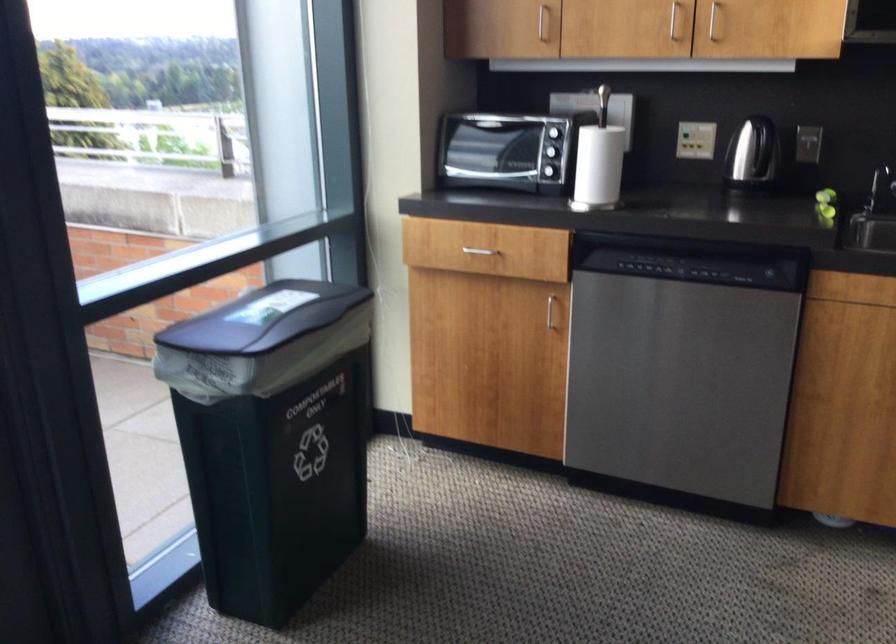
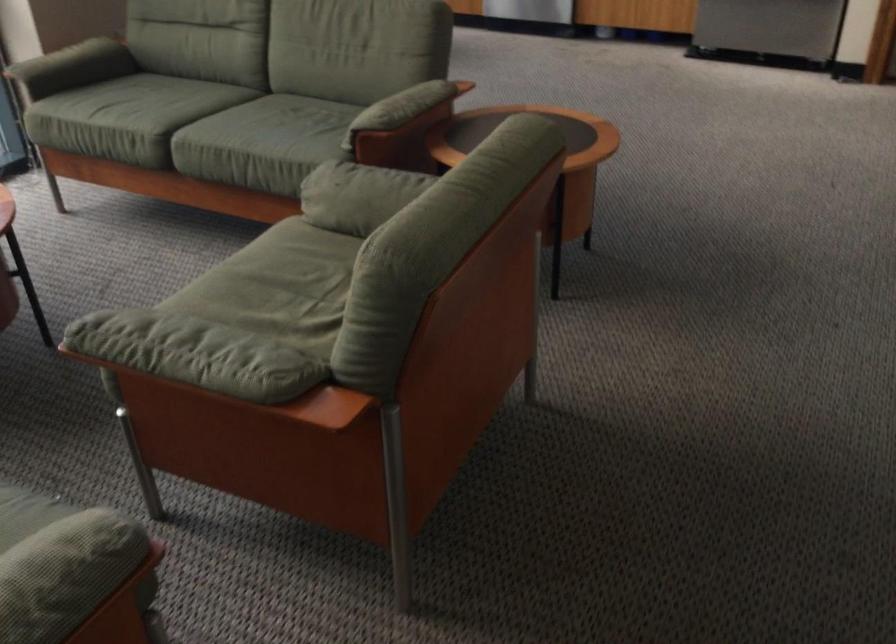
Question: What movement of the cameraman would produce the second image?

Choices:
 (A) Left
 (B) Right
 (C) Forward
 (D) Backward

Answer: (D)